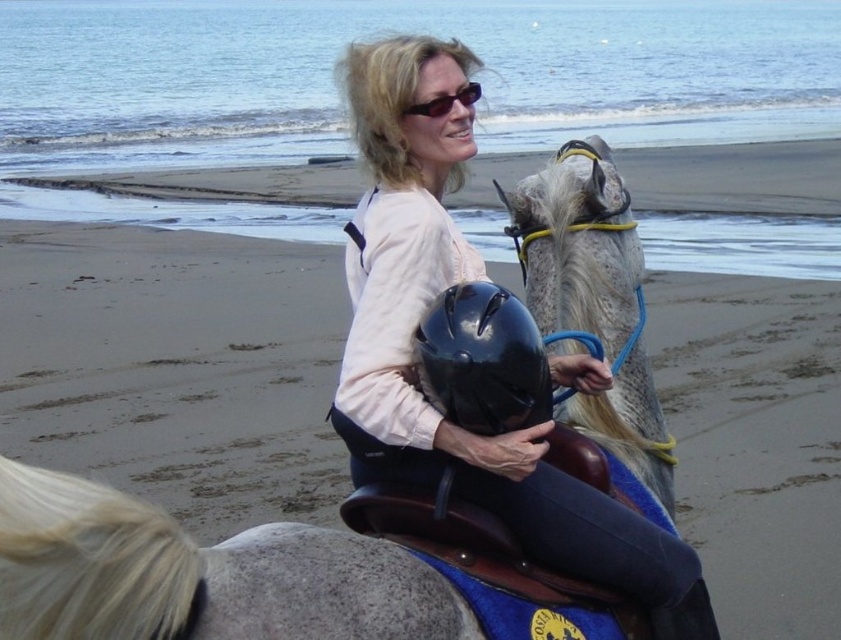
Question: Considering the real-world distances, which object is closest to the black plastic sunglasses at upper center?

Choices:
 (A) matte black helmet at center
 (B) black glossy helmet at center

Answer: (A)

Question: Can you confirm if matte black helmet at center is positioned below black plastic sunglasses at upper center?

Choices:
 (A) yes
 (B) no

Answer: (A)

Question: Is matte black helmet at center to the left of black plastic sunglasses at upper center from the viewer's perspective?

Choices:
 (A) yes
 (B) no

Answer: (B)

Question: Is black glossy helmet at center bigger than black plastic sunglasses at upper center?

Choices:
 (A) yes
 (B) no

Answer: (A)

Question: Which of the following is the farthest from the observer?

Choices:
 (A) (575, 502)
 (B) (498, 326)
 (C) (411, 109)

Answer: (C)

Question: Among these points, which one is farthest from the camera?

Choices:
 (A) pos(591,392)
 (B) pos(426,109)

Answer: (A)